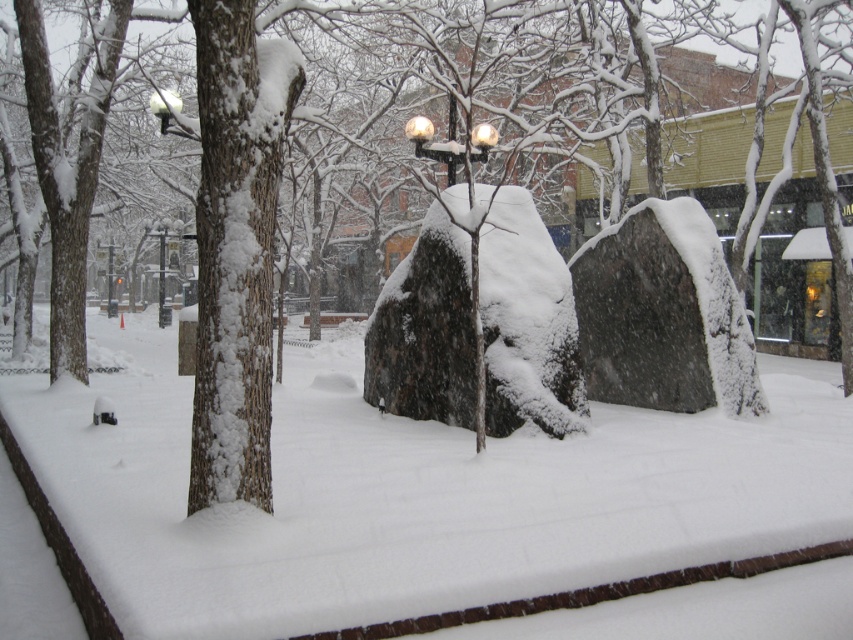
Question: Is white fluffy snow at center behind satin black lamp post at center?

Choices:
 (A) no
 (B) yes

Answer: (A)

Question: Which object appears closest to the camera in this image?

Choices:
 (A) white fluffy snow at center
 (B) satin black lamp post at center

Answer: (A)

Question: Does white fluffy snow at center appear on the left side of satin black lamp post at center?

Choices:
 (A) no
 (B) yes

Answer: (A)

Question: Where is white fluffy snow at center located in relation to satin black lamp post at center in the image?

Choices:
 (A) above
 (B) below

Answer: (B)

Question: Which point appears closest to the camera in this image?

Choices:
 (A) (422, 141)
 (B) (466, 566)

Answer: (B)

Question: Among these objects, which one is farthest from the camera?

Choices:
 (A) white fluffy snow at center
 (B) satin black lamp post at center

Answer: (B)